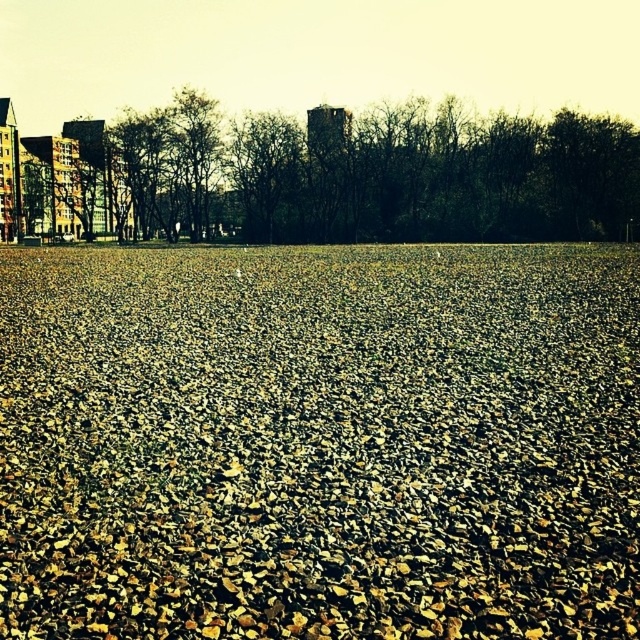
Is the position of brown gravel at center less distant than that of brown leafless tree at center?

Yes, brown gravel at center is closer to the viewer.

Does point (476, 353) come in front of point (228, 164)?

Yes, it is.

The width and height of the screenshot is (640, 640). Find the location of `brown gravel at center`. brown gravel at center is located at coordinates (320, 442).